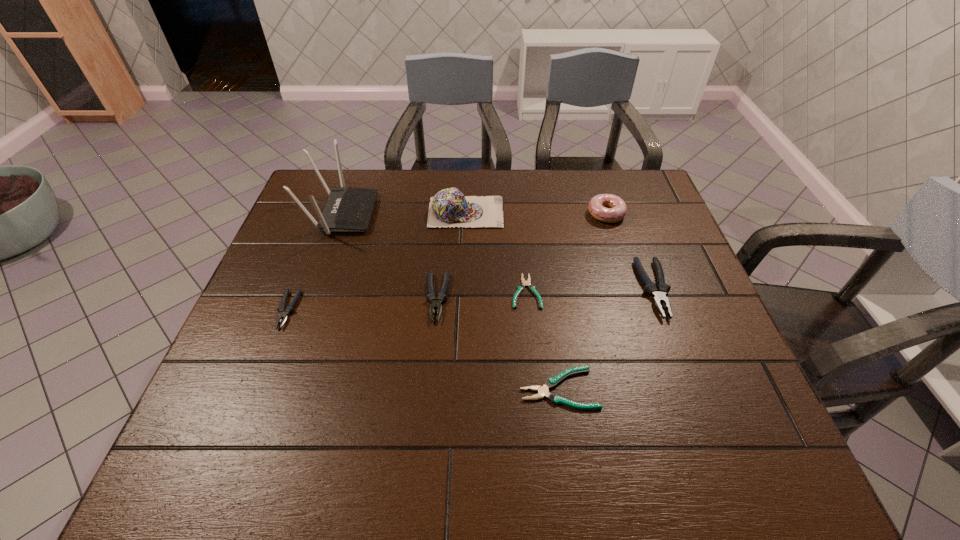
Find the location of `router`. router is located at coordinates (347, 209).

At what (x,y) coordinates should I click in order to perform the action: click on cap. Please return your answer as a coordinate pair (x, y). Looking at the image, I should click on (449, 207).

In order to click on pink doughnut in this screenshot , I will do `click(617, 209)`.

The height and width of the screenshot is (540, 960). What are the coordinates of `doughnut` in the screenshot? It's located at (617, 209).

This screenshot has height=540, width=960. In order to click on the fourth tallest object in this screenshot , I will do `click(659, 293)`.

Locate an element on the screen. The image size is (960, 540). the tallest pliers is located at coordinates (659, 293).

At what (x,y) coordinates should I click in order to perform the action: click on the second biggest gray pliers. Please return your answer as a coordinate pair (x, y). The height and width of the screenshot is (540, 960). Looking at the image, I should click on (435, 304).

Find the location of a particular element. The width and height of the screenshot is (960, 540). the second tallest pliers is located at coordinates (435, 304).

You are a GUI agent. You are given a task and a screenshot of the screen. Output one action in this format:
    pyautogui.click(x=<x>, y=<y>)
    Task: Click on the third shortest object
    
    Given the screenshot: What is the action you would take?
    pyautogui.click(x=284, y=313)

Locate an element on the screen. the third tallest pliers is located at coordinates (284, 313).